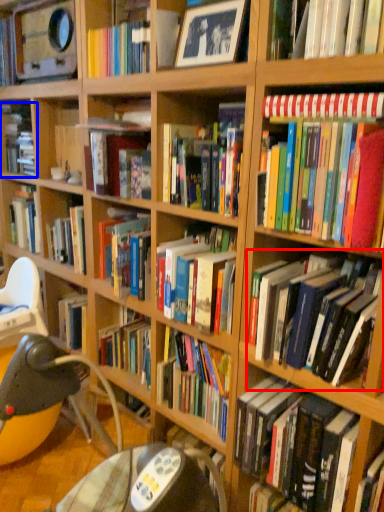
Question: Which point is closer to the camera, book (highlighted by a red box) or book (highlighted by a blue box)?

Choices:
 (A) book
 (B) book

Answer: (A)